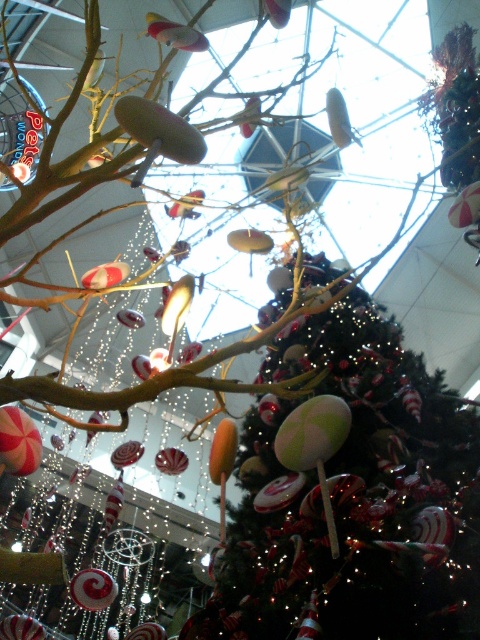
Question: Can you confirm if shiny green ball at center is positioned below shiny red lollipop at lower left?

Choices:
 (A) yes
 (B) no

Answer: (B)

Question: Which point is farther to the camera?

Choices:
 (A) shiny green ball at center
 (B) shiny red lollipop at lower left

Answer: (B)

Question: Which object is farther from the camera taking this photo?

Choices:
 (A) shiny red lollipop at lower left
 (B) shiny green ball at center

Answer: (A)

Question: Does shiny green ball at center appear on the right side of shiny red lollipop at lower left?

Choices:
 (A) yes
 (B) no

Answer: (A)

Question: Can you confirm if shiny green ball at center is positioned above shiny red lollipop at lower left?

Choices:
 (A) yes
 (B) no

Answer: (A)